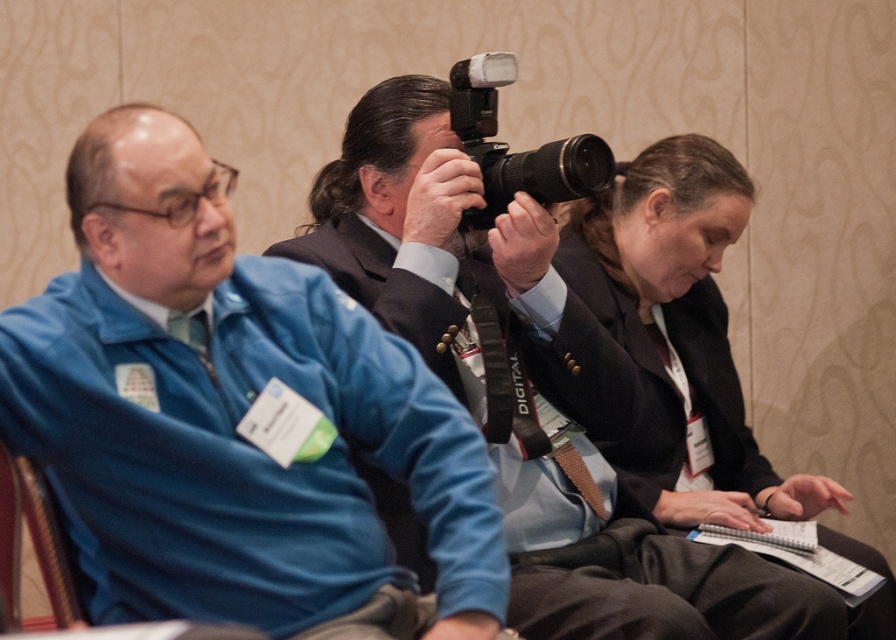
Can you confirm if black matte camera at center is wider than black plastic camera at center?

Yes, black matte camera at center is wider than black plastic camera at center.

Who is more forward, [324,218] or [472,145]?

Point [472,145] is more forward.

Is point (811, 596) more distant than point (575, 182)?

No, it is not.

Locate an element on the screen. This screenshot has height=640, width=896. black matte camera at center is located at coordinates (455, 259).

Between point (647, 156) and point (493, 83), which one is positioned behind?

Point (647, 156)

Is matte black blazer at center taller than black plastic camera at center?

Indeed, matte black blazer at center has a greater height compared to black plastic camera at center.

Image resolution: width=896 pixels, height=640 pixels. Find the location of `matte black blazer at center`. matte black blazer at center is located at coordinates (679, 333).

Can you confirm if blue fleece jacket at left is bigger than black matte camera at center?

Incorrect, blue fleece jacket at left is not larger than black matte camera at center.

What do you see at coordinates (231, 417) in the screenshot? I see `blue fleece jacket at left` at bounding box center [231, 417].

What do you see at coordinates (231, 417) in the screenshot? Image resolution: width=896 pixels, height=640 pixels. I see `blue fleece jacket at left` at bounding box center [231, 417].

Where is `blue fleece jacket at left`? This screenshot has width=896, height=640. blue fleece jacket at left is located at coordinates (231, 417).